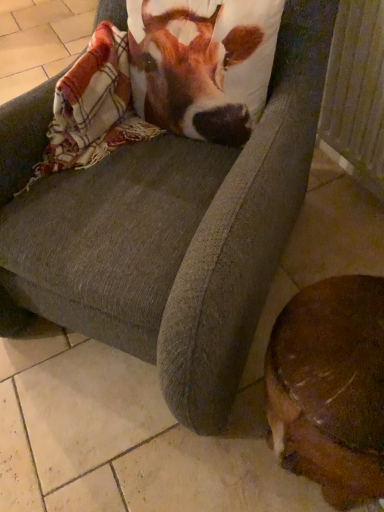
Find the location of a particular element. This screenshot has width=384, height=512. vacant space situated on the left part of brown furry dog at lower right is located at coordinates (202, 460).